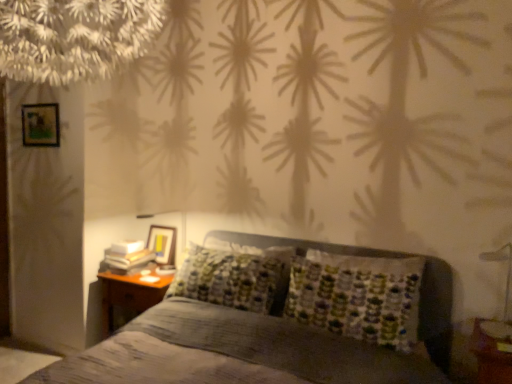
Question: From a real-world perspective, is wooden picture frame at upper left, acting as the first picture frame starting from the left, physically located above or below wooden glossy picture frame at upper left, arranged as the 1th picture frame when ordered from the bottom?

Choices:
 (A) below
 (B) above

Answer: (B)

Question: Is wooden picture frame at upper left, the second picture frame in the bottom-to-top sequence, situated inside wooden glossy picture frame at upper left, arranged as the 1th picture frame when ordered from the bottom, or outside?

Choices:
 (A) outside
 (B) inside

Answer: (A)

Question: Based on their relative distances, which object is nearer to the metallic silver bedside lamp at lower right?

Choices:
 (A) wooden picture frame at upper left, the 2th picture frame when ordered from back to front
 (B) textured gray bed at center
 (C) woodennightstand at lower left
 (D) wooden glossy picture frame at upper left, the first picture frame positioned from the right

Answer: (B)

Question: Estimate the real-world distances between objects in this image. Which object is closer to the textured gray bed at center?

Choices:
 (A) wooden picture frame at upper left, the second picture frame in the bottom-to-top sequence
 (B) wooden glossy picture frame at upper left, acting as the 2th picture frame starting from the top
 (C) metallic silver bedside lamp at lower right
 (D) woodennightstand at lower left

Answer: (D)